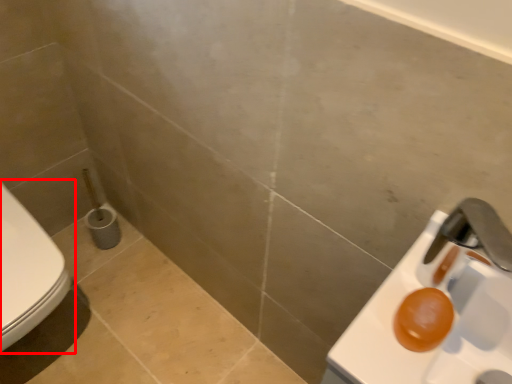
Question: From the image's perspective, where is toilet (annotated by the red box) located in relation to sink in the image?

Choices:
 (A) below
 (B) above

Answer: (B)